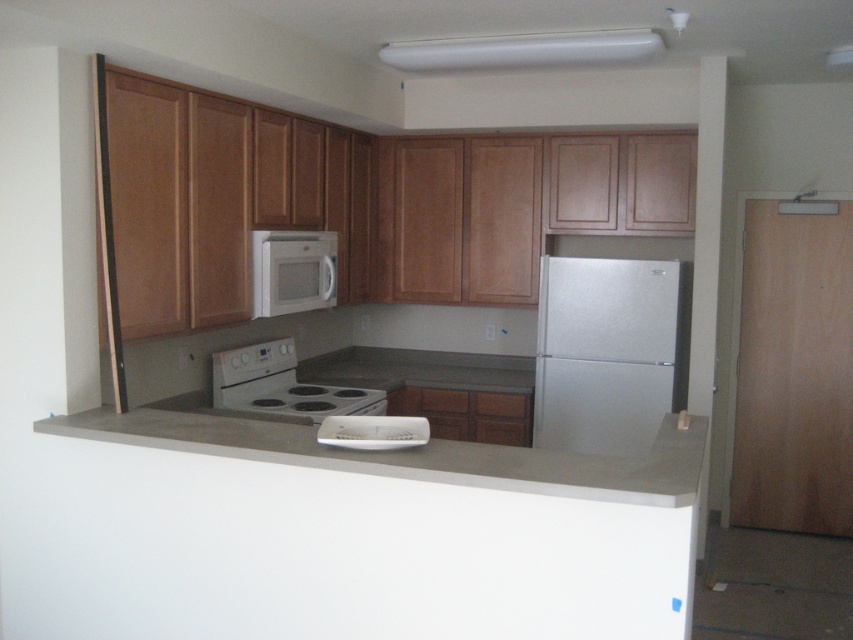
You are moving into this kitchen and need to place a new microwave above the white glossy electric stove at center. Is there space for it given the silver metallic refrigerator at right?

The silver metallic refrigerator at right is above the white glossy electric stove at center, so there is no space to place the microwave there as the refrigerator already occupies that area.

You are a delivery person who needs to place a new microwave that is 1.8 meters wide into the kitchen. The current microwave is above the stove. Can you fit the new microwave between the concrete at center and the white plastic exhaust hood at upper center?

The distance between the concrete at center and the white plastic exhaust hood at upper center is 1.75 meters. Since the new microwave is 1.8 meters wide, it cannot fit in the space between them.